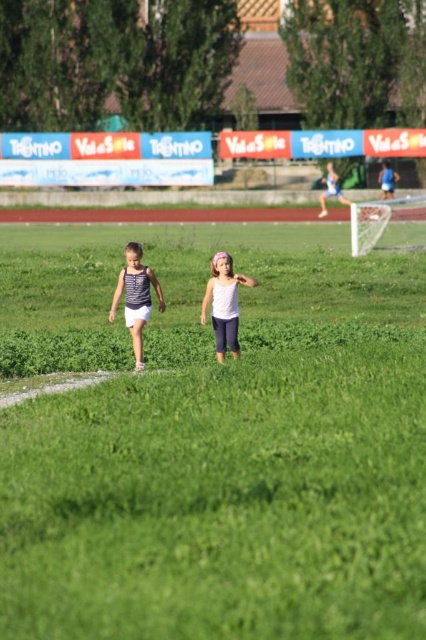
Question: Which point is closer to the camera?

Choices:
 (A) (164, 433)
 (B) (131, 301)
 (C) (221, 282)

Answer: (A)

Question: Which point is closer to the camera?

Choices:
 (A) white cotton tank top at center
 (B) green grass at center

Answer: (B)

Question: Which of the following is the closest to the observer?

Choices:
 (A) (253, 408)
 (B) (215, 268)

Answer: (A)

Question: In this image, where is green grass at center located relative to white cotton tank top at center?

Choices:
 (A) left
 (B) right

Answer: (B)

Question: Can you confirm if white cotton tank top at center is smaller than white matte tank top at center?

Choices:
 (A) yes
 (B) no

Answer: (B)

Question: Is green grass at center positioned before white cotton tank top at center?

Choices:
 (A) yes
 (B) no

Answer: (A)